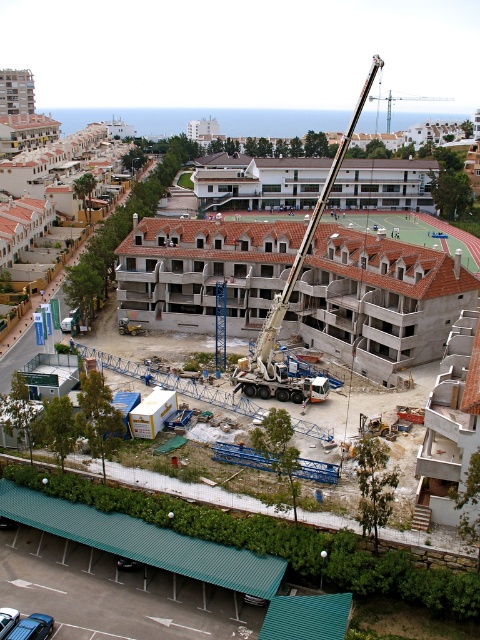
Question: Is white metallic crane at center bigger than metallic silver crane at upper center?

Choices:
 (A) yes
 (B) no

Answer: (A)

Question: Among these points, which one is farthest from the camera?

Choices:
 (A) (439, 97)
 (B) (313, 211)

Answer: (A)

Question: Is white metallic crane at center below metallic silver crane at upper center?

Choices:
 (A) yes
 (B) no

Answer: (A)

Question: Can you confirm if white metallic crane at center is smaller than metallic silver crane at upper center?

Choices:
 (A) no
 (B) yes

Answer: (A)

Question: Which point is farther to the camera?

Choices:
 (A) metallic silver crane at upper center
 (B) white metallic crane at center

Answer: (A)